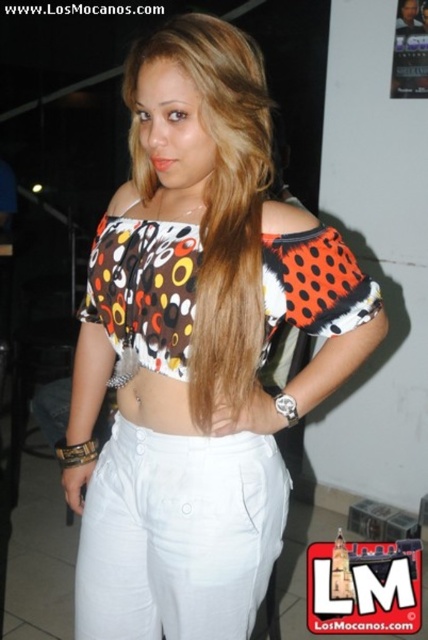
You are a fashion designer looking at this outfit. You see a printed fabric top at center and a printed fabric bikini top at center. Which one is bigger in size?

The printed fabric top at center has a larger size compared to the printed fabric bikini top at center.

Based on the photo, you are a fashion designer trying to create a matching accessory for this outfit. The accessory needs to be placed between the white cotton pants at center and the brown silky hair at center. Is there enough space to place a 12 inch long accessory between them?

The distance between the white cotton pants at center and the brown silky hair at center is 13.26 inches. Since the accessory is 12 inches long, it can fit within the available space.

You are a fashion designer trying to decide between two tops for a client. The client wants to know which one is wider. The options are the printed fabric top at center and the printed fabric bikini top at center. Which one is wider?

The printed fabric top at center is wider than the printed fabric bikini top at center according to the description.